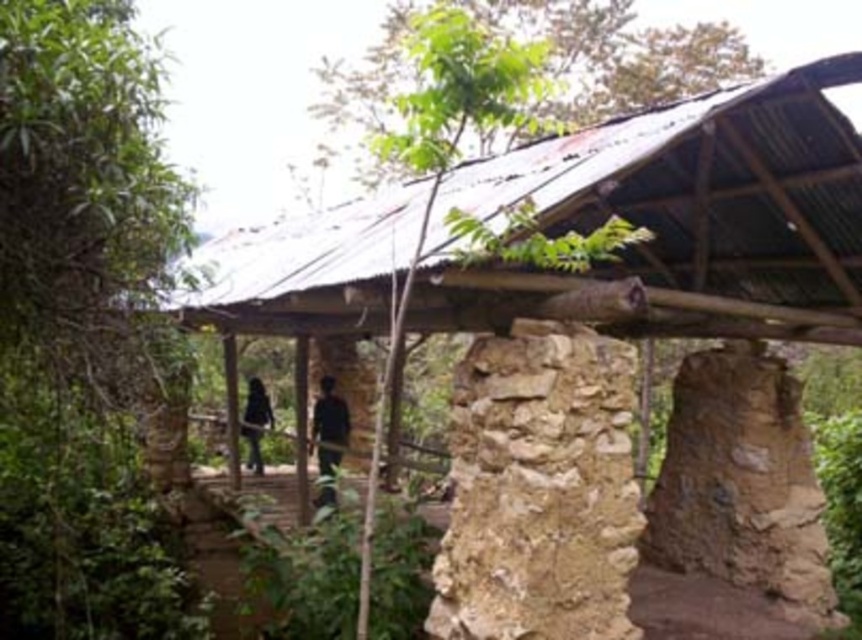
Who is more forward, (94, 29) or (261, 404)?

Positioned in front is point (94, 29).

Does point (113, 131) come in front of point (253, 381)?

Yes, point (113, 131) is in front of point (253, 381).

Where is `green leafy tree at left`? This screenshot has height=640, width=862. green leafy tree at left is located at coordinates (80, 324).

Does dark blue fabric at center appear under black matte clothing at center?

No, dark blue fabric at center is not below black matte clothing at center.

Is point (323, 394) farther from viewer compared to point (261, 392)?

No, it is not.

Where is `dark blue fabric at center`? This screenshot has width=862, height=640. dark blue fabric at center is located at coordinates (330, 413).

This screenshot has height=640, width=862. In order to click on green leafy tree at left in this screenshot , I will do pyautogui.click(x=80, y=324).

Is point (48, 598) less distant than point (333, 492)?

No, (48, 598) is further to viewer.

Which is in front, point (102, 552) or point (330, 499)?

Point (330, 499) is in front.

Where is `green leafy tree at left`? The width and height of the screenshot is (862, 640). green leafy tree at left is located at coordinates (80, 324).